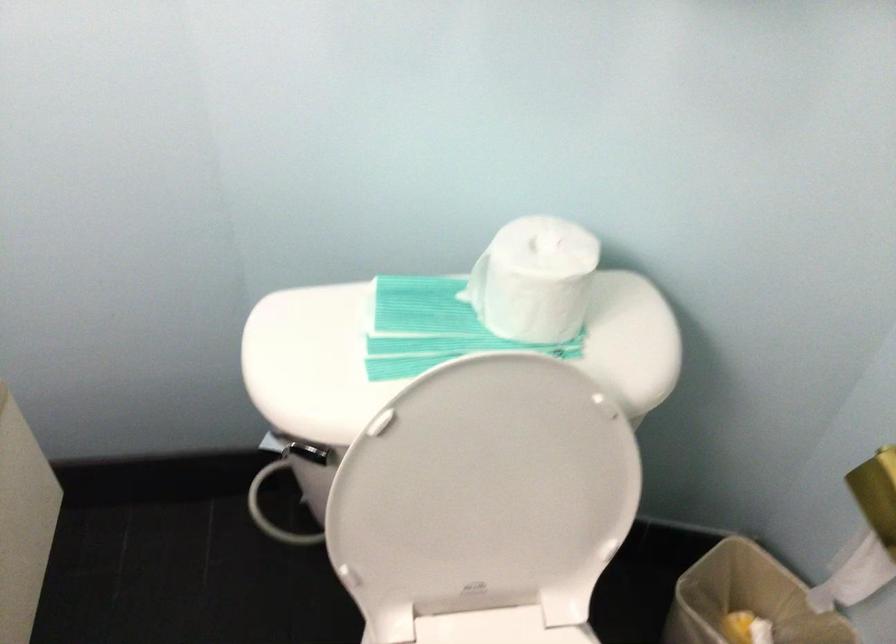
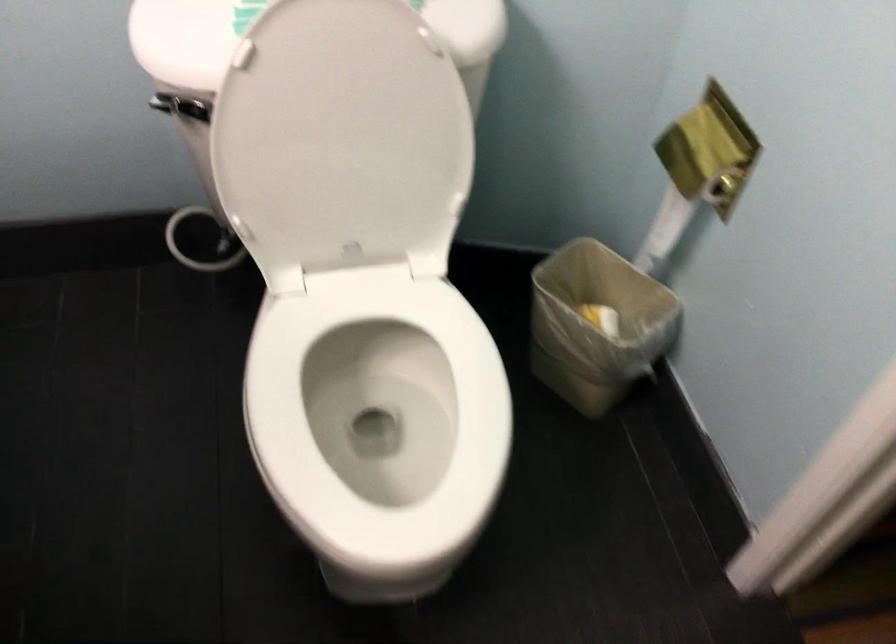
What movement of the cameraman would produce the second image?

The cameraman walked toward right, backward.